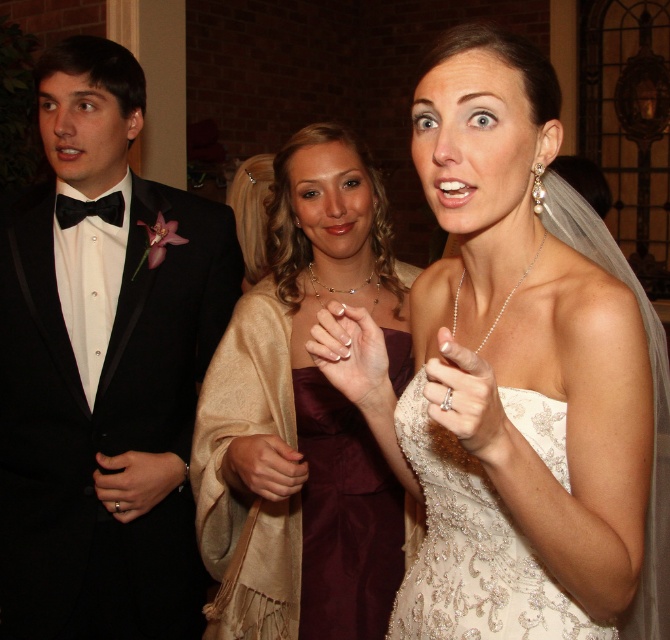
You are a photographer at the event and want to take a closeup of the satin gold dress at center without the ivory lace dress at center being in the shot. Is that possible?

The satin gold dress at center is further to the viewer than the ivory lace dress at center, so you can focus on the satin gold dress at center and exclude the ivory lace dress at center from the frame by adjusting the camera angle or zoom.

You are at the center of the image and want to hand a gift to the person wearing the black satin tuxedo at left. In which direction should you move to reach them?

The black satin tuxedo at left is located at point (103, 368), so you should move to the left to reach them.